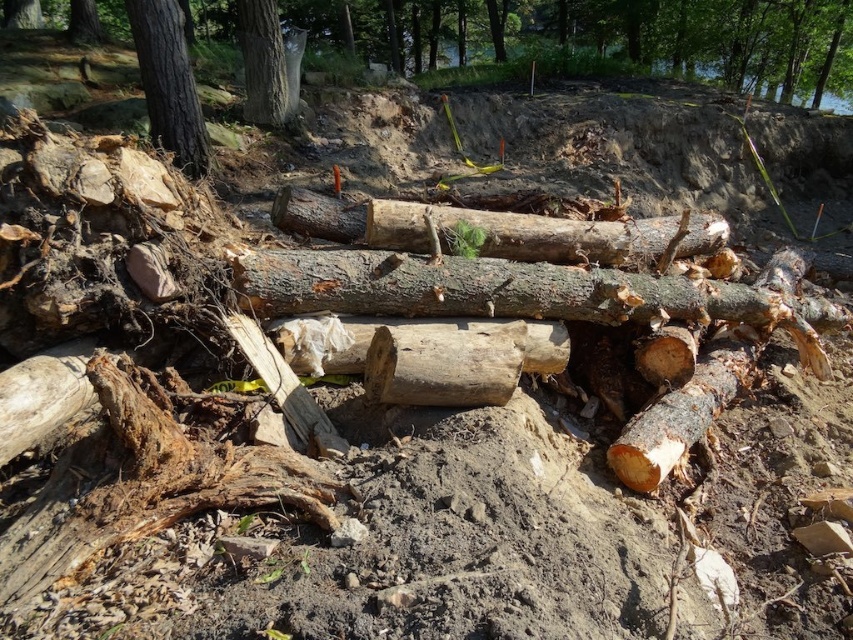
Does point (267, 253) lie in front of point (277, 36)?

Yes, point (267, 253) is in front of point (277, 36).

Is brown rough wood at center shorter than smooth gray bark at upper left?

Yes.

At what (x,y) coordinates should I click in order to perform the action: click on brown rough wood at center. Please return your answer as a coordinate pair (x, y). Looking at the image, I should click on (498, 291).

Locate an element on the screen. brown rough wood at center is located at coordinates (498, 291).

Does brown rough wood at center have a smaller size compared to natural wood log at center?

Actually, brown rough wood at center might be larger than natural wood log at center.

Based on the photo, is brown rough wood at center above natural wood log at center?

Incorrect, brown rough wood at center is not positioned above natural wood log at center.

Locate an element on the screen. The image size is (853, 640). brown rough wood at center is located at coordinates (498, 291).

Where is `brown rough wood at center`? The image size is (853, 640). brown rough wood at center is located at coordinates (498, 291).

Looking at this image, can you confirm if natural wood log at center is thinner than smooth brown tree trunk at upper left?

In fact, natural wood log at center might be wider than smooth brown tree trunk at upper left.

Who is positioned more to the left, natural wood log at center or smooth brown tree trunk at upper left?

smooth brown tree trunk at upper left is more to the left.

Locate an element on the screen. Image resolution: width=853 pixels, height=640 pixels. natural wood log at center is located at coordinates (471, 225).

This screenshot has width=853, height=640. What are the coordinates of `natural wood log at center` in the screenshot? It's located at (471, 225).